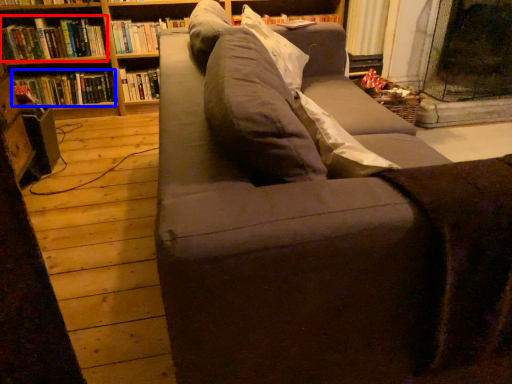
Question: Which object appears farthest to the camera in this image, book (highlighted by a red box) or book (highlighted by a blue box)?

Choices:
 (A) book
 (B) book

Answer: (B)